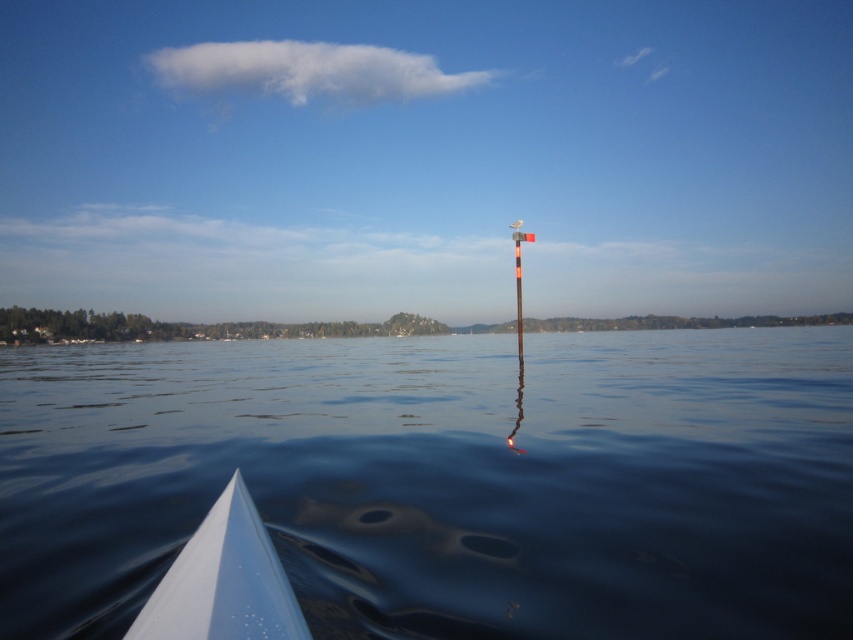
Question: Is transparent water at center to the left of white glossy boat at lower left from the viewer's perspective?

Choices:
 (A) yes
 (B) no

Answer: (B)

Question: Is transparent water at center positioned in front of white glossy boat at lower left?

Choices:
 (A) no
 (B) yes

Answer: (A)

Question: Can you confirm if transparent water at center is smaller than white glossy boat at lower left?

Choices:
 (A) yes
 (B) no

Answer: (B)